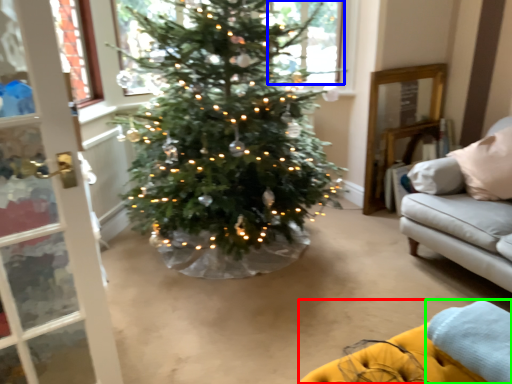
Question: Which object is the farthest from couch (highlighted by a red box)? Choose among these: window (highlighted by a blue box) or blanket (highlighted by a green box).

Choices:
 (A) window
 (B) blanket

Answer: (A)